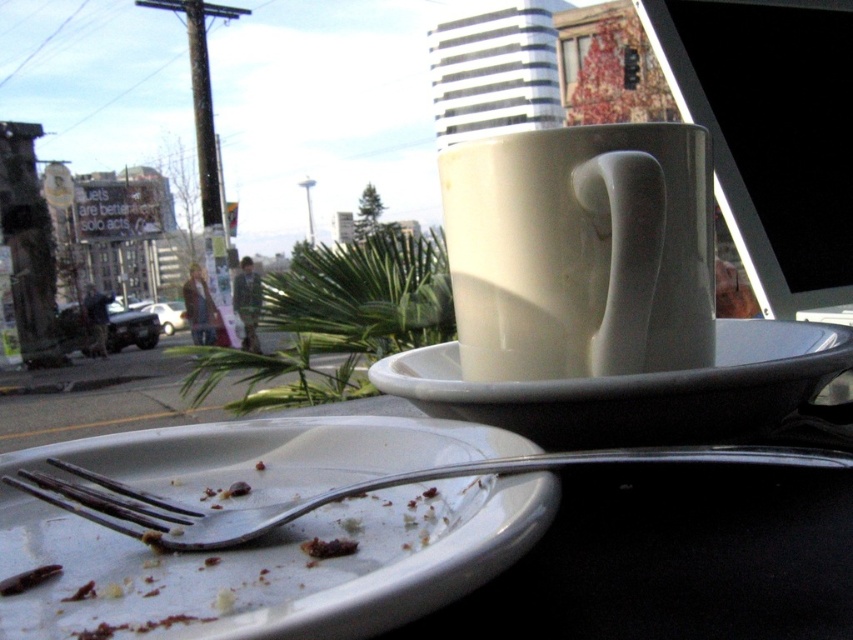
Question: Which object is farther from the camera taking this photo?

Choices:
 (A) white matte saucer at center
 (B) white ceramic mug at upper center
 (C) white matte plate at lower left

Answer: (B)

Question: Can you confirm if white matte plate at lower left is thinner than white matte saucer at center?

Choices:
 (A) no
 (B) yes

Answer: (B)

Question: Can you confirm if white matte plate at lower left is bigger than white ceramic mug at upper center?

Choices:
 (A) yes
 (B) no

Answer: (A)

Question: Which point is farther from the camera taking this photo?

Choices:
 (A) (508, 243)
 (B) (763, 381)
 (C) (231, 481)

Answer: (A)

Question: Among these objects, which one is nearest to the camera?

Choices:
 (A) white matte plate at lower left
 (B) white ceramic mug at upper center
 (C) white matte saucer at center

Answer: (A)

Question: Is the position of white ceramic mug at upper center more distant than that of white matte saucer at center?

Choices:
 (A) yes
 (B) no

Answer: (A)